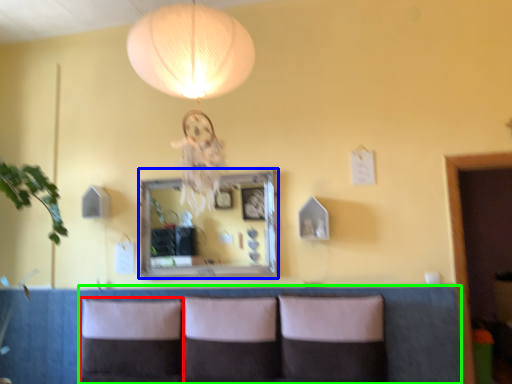
Question: Considering the real-world distances, which object is farthest from pillow (highlighted by a red box)? mirror (highlighted by a blue box) or couch (highlighted by a green box)?

Choices:
 (A) mirror
 (B) couch

Answer: (B)